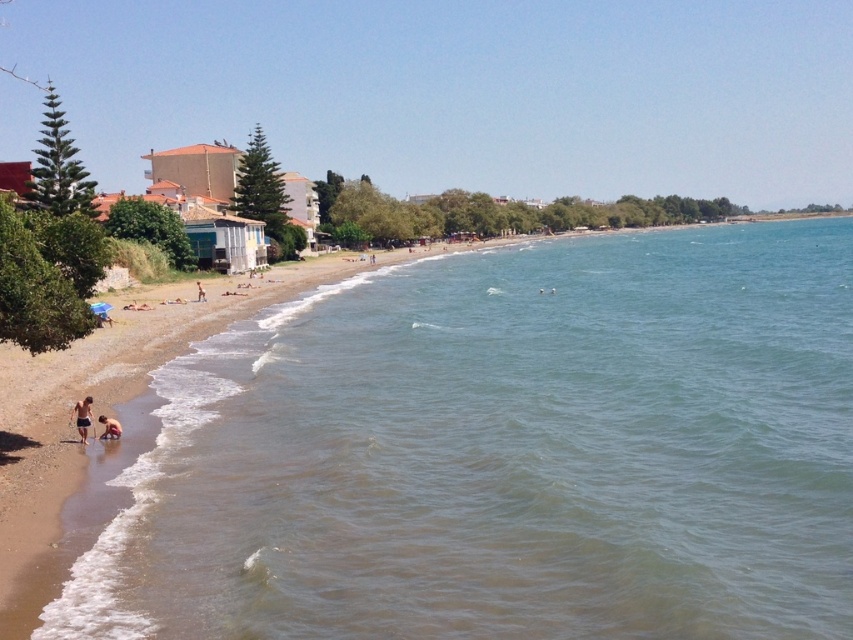
Question: Does brown sand at lower left appear over tan skin person at lower left?

Choices:
 (A) yes
 (B) no

Answer: (A)

Question: Estimate the real-world distances between objects in this image. Which object is farther from the tan skin person at lower left?

Choices:
 (A) brown sand at lower left
 (B) tan skin human at lower left

Answer: (B)

Question: Does brown sand at lower left have a greater width compared to tan skin person at lower left?

Choices:
 (A) yes
 (B) no

Answer: (A)

Question: From the image, what is the correct spatial relationship of brown sand at lower left in relation to tan skin human at lower left?

Choices:
 (A) right
 (B) left

Answer: (A)

Question: Which point appears closest to the camera in this image?

Choices:
 (A) (199, 296)
 (B) (100, 417)

Answer: (B)

Question: Which point appears closest to the camera in this image?

Choices:
 (A) (618, 445)
 (B) (86, 428)

Answer: (A)